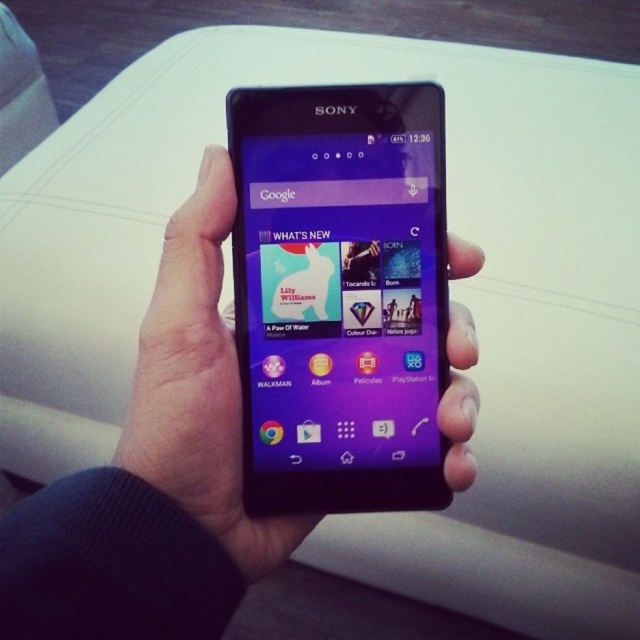
Question: Which point appears closest to the camera in this image?

Choices:
 (A) (394, 179)
 (B) (51, 625)

Answer: (B)

Question: Considering the relative positions of matte black smartphone at center and black matte phone at center in the image provided, where is matte black smartphone at center located with respect to black matte phone at center?

Choices:
 (A) above
 (B) below

Answer: (A)

Question: Among these objects, which one is farthest from the camera?

Choices:
 (A) matte black smartphone at center
 (B) black matte phone at center

Answer: (A)

Question: Does matte black smartphone at center appear on the right side of black matte phone at center?

Choices:
 (A) yes
 (B) no

Answer: (A)

Question: Can you confirm if matte black smartphone at center is positioned above black matte phone at center?

Choices:
 (A) no
 (B) yes

Answer: (B)